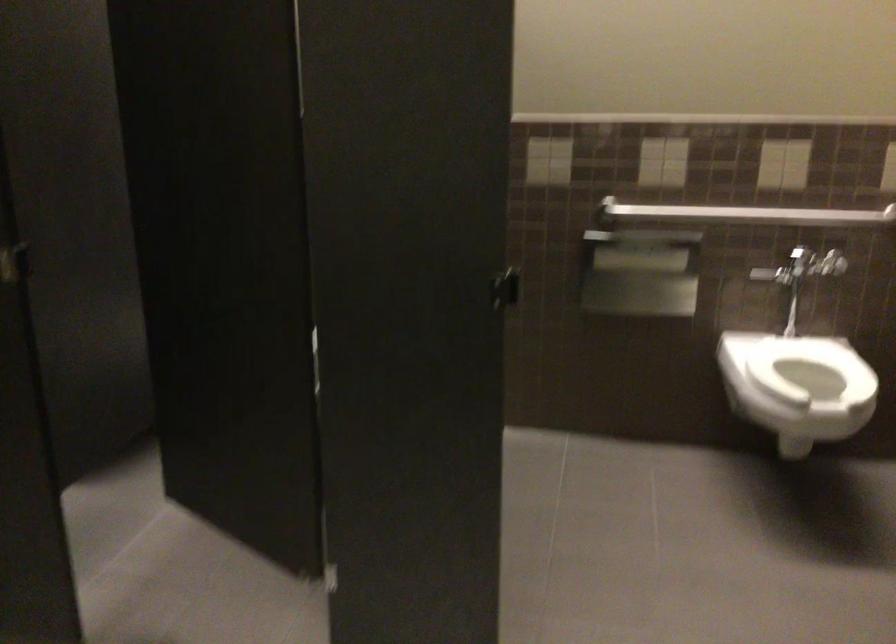
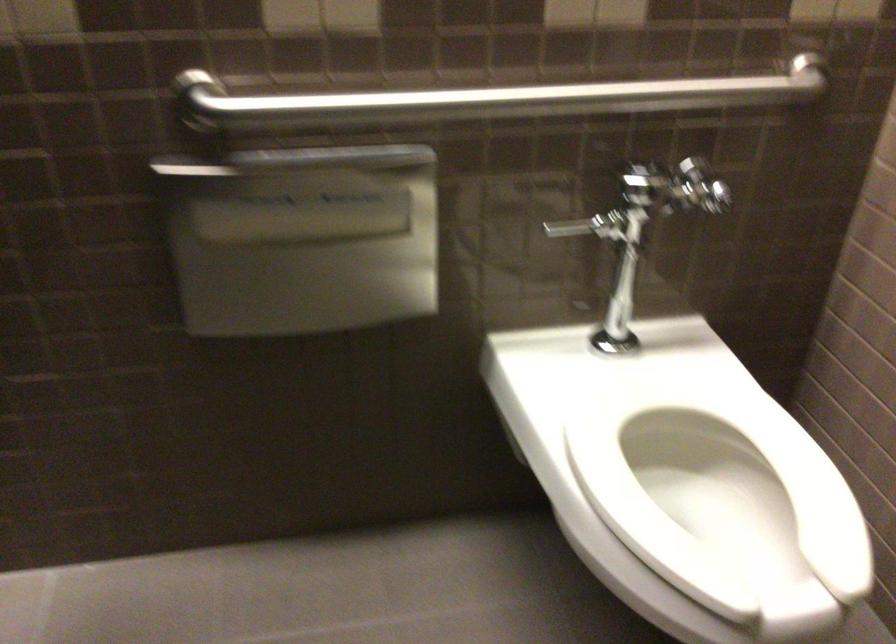
Find the pixel in the second image that matches point 734,205 in the first image.

(488, 100)